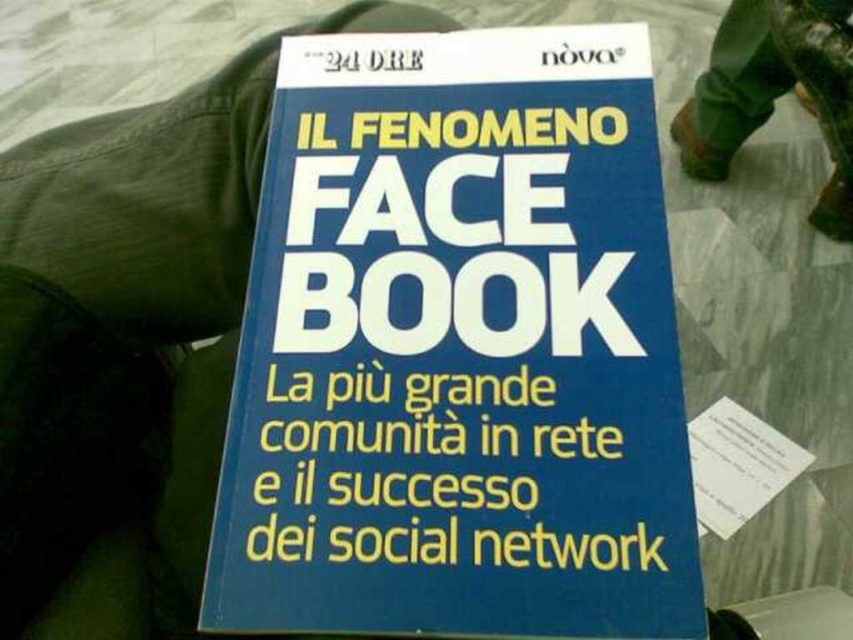
Who is taller, blue paper book at center or green fabric at upper left?

green fabric at upper left

Who is higher up, blue paper book at center or green fabric at upper left?

Positioned higher is green fabric at upper left.

Identify the location of blue paper book at center. (459, 349).

Where is `blue paper book at center`? The width and height of the screenshot is (853, 640). blue paper book at center is located at coordinates (459, 349).

Which is more to the left, blue paper book at center or camouflage fabric pants at upper right?

blue paper book at center

Does blue paper book at center appear on the left side of camouflage fabric pants at upper right?

Yes, blue paper book at center is to the left of camouflage fabric pants at upper right.

Does point (293, 531) come in front of point (827, 209)?

That is True.

Where is `blue paper book at center`? blue paper book at center is located at coordinates (459, 349).

Between green fabric at upper left and camouflage fabric pants at upper right, which one appears on the left side from the viewer's perspective?

green fabric at upper left is more to the left.

This screenshot has width=853, height=640. I want to click on green fabric at upper left, so click(128, 340).